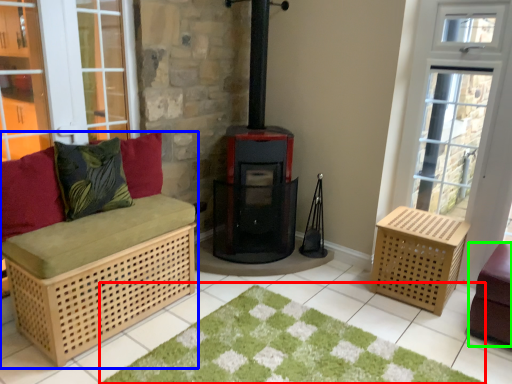
Question: Which is nearer to the doormat (highlighted by a red box)? furniture (highlighted by a blue box) or furniture (highlighted by a green box).

Choices:
 (A) furniture
 (B) furniture

Answer: (A)